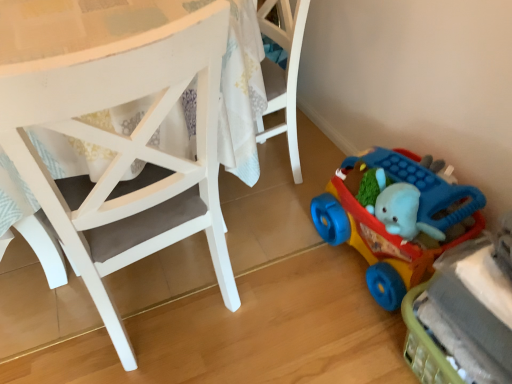
Question: Should I look upward or downward to see white matte chair at center?

Choices:
 (A) down
 (B) up

Answer: (B)

Question: Is rubberized plastic toy car at lower right, acting as the 2th toy starting from the bottom, at the left side of rubberized plastic toy car at lower right, arranged as the 2th toy when viewed from the top?

Choices:
 (A) yes
 (B) no

Answer: (A)

Question: From the image's perspective, does rubberized plastic toy car at lower right, acting as the 2th toy starting from the bottom, appear higher than rubberized plastic toy car at lower right, the first toy from the bottom?

Choices:
 (A) no
 (B) yes

Answer: (B)

Question: Is rubberized plastic toy car at lower right, acting as the 2th toy starting from the bottom, smaller than rubberized plastic toy car at lower right, arranged as the 2th toy when viewed from the top?

Choices:
 (A) no
 (B) yes

Answer: (A)

Question: Is rubberized plastic toy car at lower right, acting as the 2th toy starting from the bottom, positioned beyond the bounds of rubberized plastic toy car at lower right, arranged as the 2th toy when viewed from the top?

Choices:
 (A) no
 (B) yes

Answer: (B)

Question: From the image's perspective, would you say rubberized plastic toy car at lower right, the 1th toy from the top, is shown under rubberized plastic toy car at lower right, the first toy from the bottom?

Choices:
 (A) yes
 (B) no

Answer: (B)

Question: Considering the relative sizes of rubberized plastic toy car at lower right, the 1th toy from the top, and rubberized plastic toy car at lower right, arranged as the 2th toy when viewed from the top, in the image provided, is rubberized plastic toy car at lower right, the 1th toy from the top, taller than rubberized plastic toy car at lower right, arranged as the 2th toy when viewed from the top,?

Choices:
 (A) yes
 (B) no

Answer: (A)

Question: Is rubberized plastic toy car at lower right, the first toy from the bottom, looking in the opposite direction of rubberized plastic toy car at lower right, the 1th toy from the top?

Choices:
 (A) yes
 (B) no

Answer: (B)

Question: From the image's perspective, would you say rubberized plastic toy car at lower right, the first toy from the bottom, is positioned over rubberized plastic toy car at lower right, the 1th toy from the top?

Choices:
 (A) yes
 (B) no

Answer: (B)

Question: Does rubberized plastic toy car at lower right, the first toy from the bottom, come behind rubberized plastic toy car at lower right, acting as the 2th toy starting from the bottom?

Choices:
 (A) yes
 (B) no

Answer: (B)

Question: Does rubberized plastic toy car at lower right, the first toy from the bottom, have a greater width compared to rubberized plastic toy car at lower right, acting as the 2th toy starting from the bottom?

Choices:
 (A) no
 (B) yes

Answer: (A)

Question: Is rubberized plastic toy car at lower right, arranged as the 2th toy when viewed from the top, located outside rubberized plastic toy car at lower right, acting as the 2th toy starting from the bottom?

Choices:
 (A) no
 (B) yes

Answer: (B)

Question: Is rubberized plastic toy car at lower right, the first toy from the bottom, surrounding rubberized plastic toy car at lower right, acting as the 2th toy starting from the bottom?

Choices:
 (A) no
 (B) yes

Answer: (A)

Question: Is white matte chair at center turned away from rubberized plastic toy car at lower right, acting as the 2th toy starting from the bottom?

Choices:
 (A) yes
 (B) no

Answer: (B)